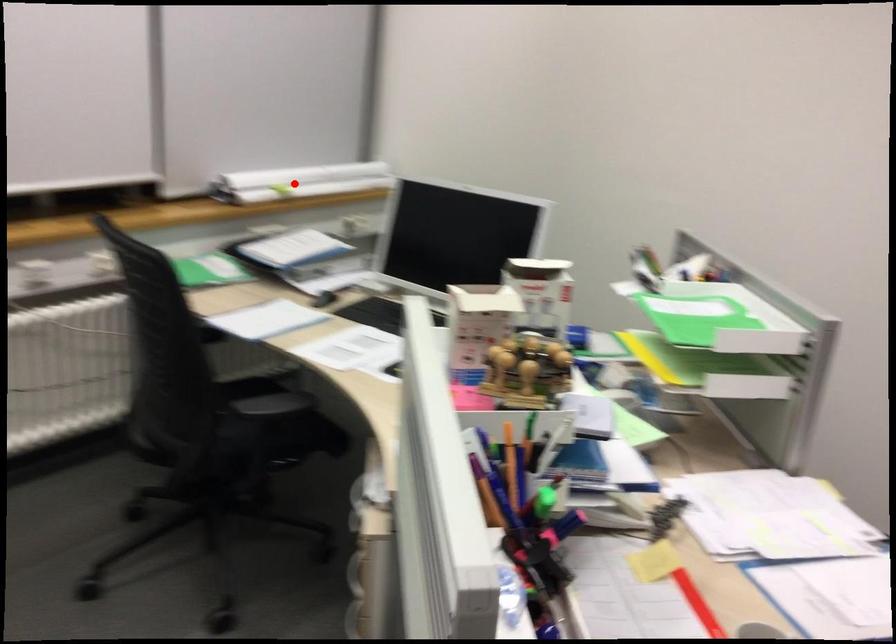
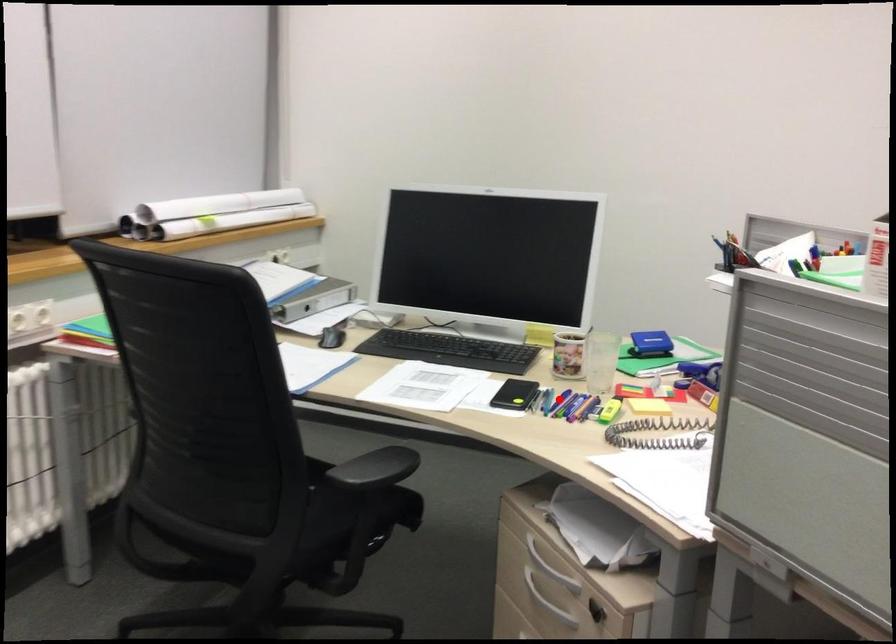
I am providing you with two images of the same scene from different viewpoints. A red point is marked on the first image and another point is marked on the second image. Are the points marked in image1 and image2 representing the same 3D position?

No